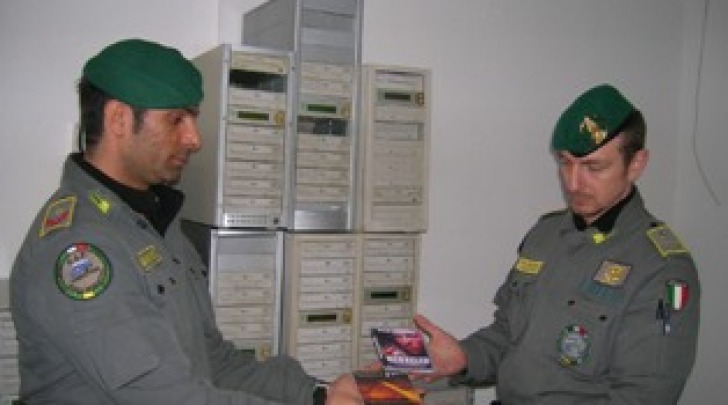
Locate an element on the screen. pens is located at coordinates (656, 309), (667, 325).